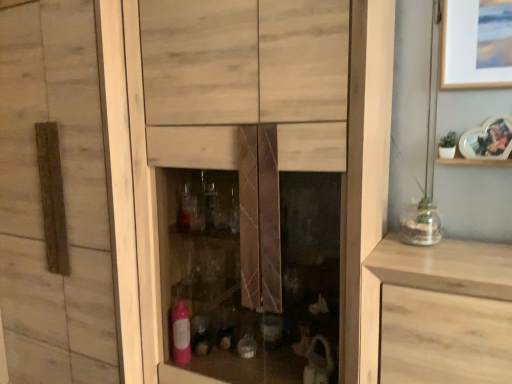
Identify the location of vacant region to the right of clear glass vase at right. (472, 241).